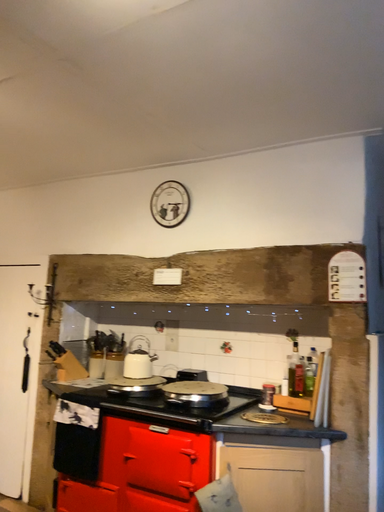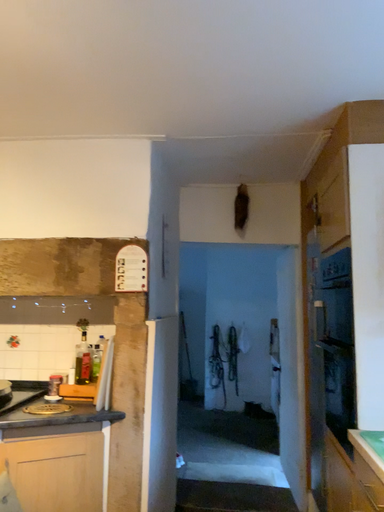
Question: How did the camera likely rotate when shooting the video?

Choices:
 (A) rotated right
 (B) rotated left

Answer: (A)